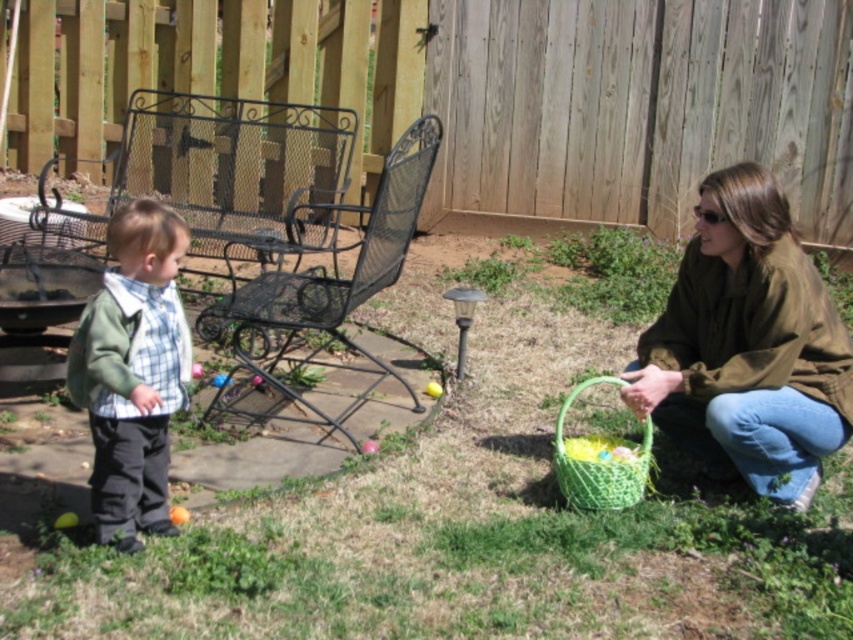
Question: Where is green cotton shirt at left located in relation to green woven basket at lower right in the image?

Choices:
 (A) right
 (B) left

Answer: (B)

Question: Based on their relative distances, which object is nearer to the green cotton shirt at left?

Choices:
 (A) green woven basket at lower right
 (B) matte brown jacket at lower right

Answer: (A)

Question: Which point is closer to the camera?

Choices:
 (A) (160, 256)
 (B) (747, 276)

Answer: (A)

Question: Is green cotton shirt at left further to camera compared to green woven basket at lower right?

Choices:
 (A) no
 (B) yes

Answer: (A)

Question: Is matte brown jacket at lower right positioned before green woven basket at lower right?

Choices:
 (A) yes
 (B) no

Answer: (A)

Question: Which point is farther to the camera?

Choices:
 (A) green woven basket at lower right
 (B) matte brown jacket at lower right

Answer: (A)